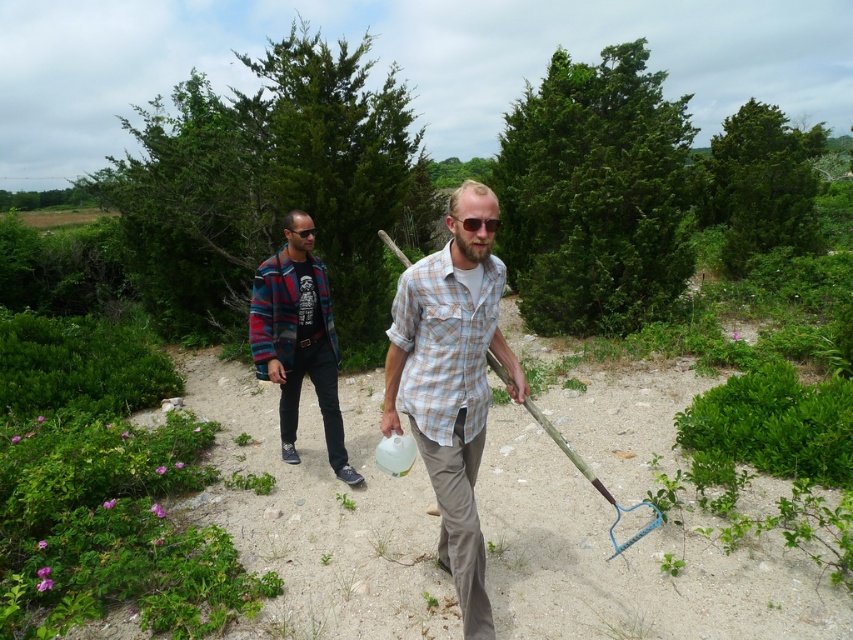
Question: Which of the following is the farthest from the observer?

Choices:
 (A) (264, 308)
 (B) (428, 266)

Answer: (A)

Question: Can you confirm if plaid cotton shirt at center is bigger than plaid wool jacket at left?

Choices:
 (A) yes
 (B) no

Answer: (B)

Question: Which point appears farthest from the camera in this image?

Choices:
 (A) (309, 253)
 (B) (474, 440)

Answer: (A)

Question: Observing the image, what is the correct spatial positioning of plaid cotton shirt at center in reference to plaid wool jacket at left?

Choices:
 (A) right
 (B) left

Answer: (A)

Question: Does plaid cotton shirt at center appear under plaid wool jacket at left?

Choices:
 (A) yes
 (B) no

Answer: (A)